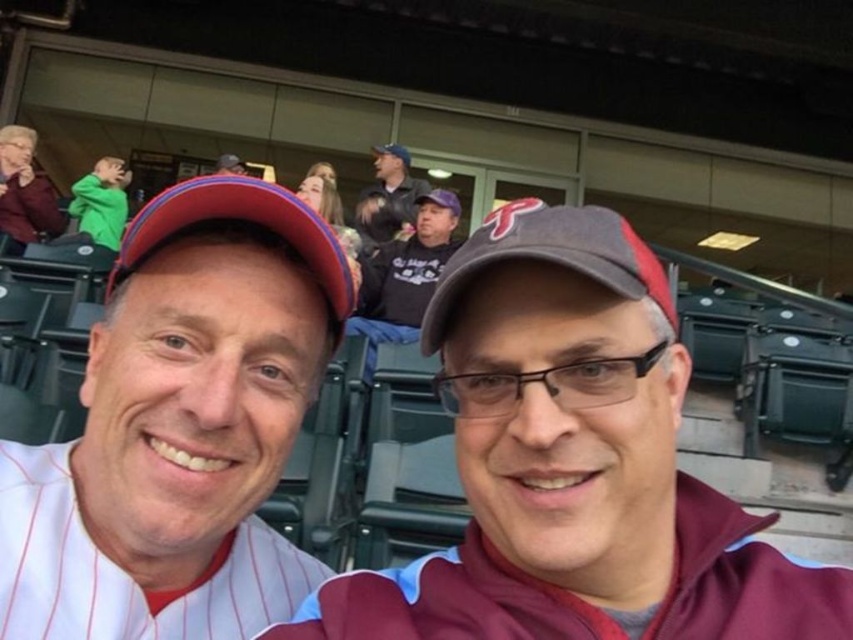
You are a photographer at the baseball stadium and want to capture the maroon fabric jacket at center in your shot. What coordinates should you aim for?

The maroon fabric jacket at center is located at coordinates point (573,465).

You are standing at the center of the baseball stadium and want to walk to both the point at coordinates point [239,288] and point [363,236]. Which point should you reach first if you want to visit them in order from closest to farthest?

You should reach point [239,288] first because it is in front of point [363,236], meaning it is closer to you.

You are a photographer at the baseball stadium and want to capture a photo of the dark gray hoodie at center and the dark blue baseball cap at upper center. Which object should you adjust your camera to focus on first if you need to start from the left side and move towards the right?

The dark blue baseball cap at upper center should be focused on first because it is located to the left of the dark gray hoodie at center.